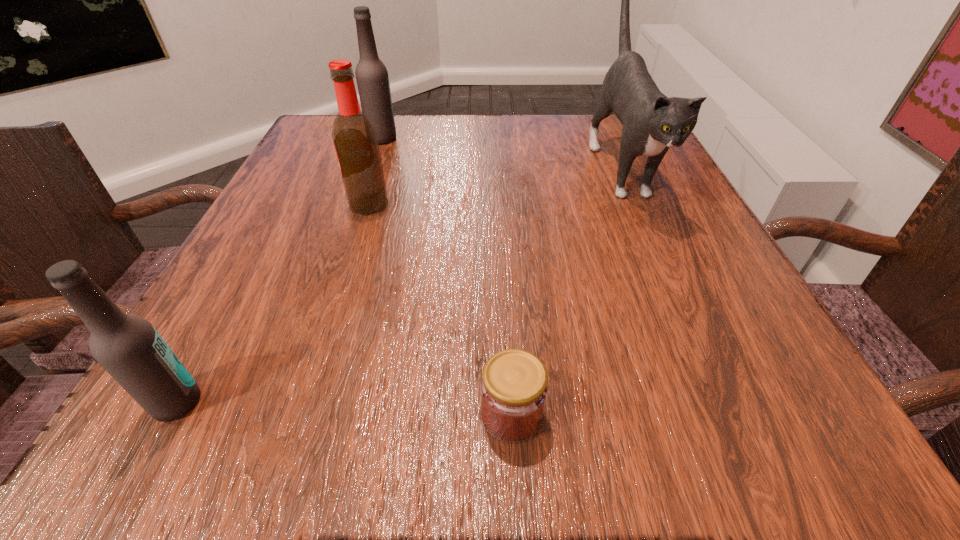
At what (x,y) coordinates should I click in order to perform the action: click on vacant space at the far edge of the desktop. Please return your answer as a coordinate pair (x, y). Looking at the image, I should click on (524, 129).

The height and width of the screenshot is (540, 960). I want to click on free space at the near edge, so (372, 397).

In the image, there is a desktop. Find the location of `blank space at the left edge`. blank space at the left edge is located at coordinates (315, 241).

Locate an element on the screen. The width and height of the screenshot is (960, 540). free space at the right edge is located at coordinates (653, 180).

Locate an element on the screen. blank space at the near left corner of the desktop is located at coordinates pos(277,384).

Find the location of a particular element. free space at the near right corner of the desktop is located at coordinates 840,437.

Where is `vacant space in between the shortest beer bottle and the jam`? vacant space in between the shortest beer bottle and the jam is located at coordinates (344, 408).

Where is `empty space that is in between the jam and the second farthest beer bottle`? This screenshot has height=540, width=960. empty space that is in between the jam and the second farthest beer bottle is located at coordinates (440, 309).

Where is `vacant area between the shortest object and the second farthest beer bottle`? The image size is (960, 540). vacant area between the shortest object and the second farthest beer bottle is located at coordinates (440, 309).

At what (x,y) coordinates should I click in order to perform the action: click on free space between the shortest beer bottle and the farthest beer bottle. Please return your answer as a coordinate pair (x, y). The width and height of the screenshot is (960, 540). Looking at the image, I should click on (279, 270).